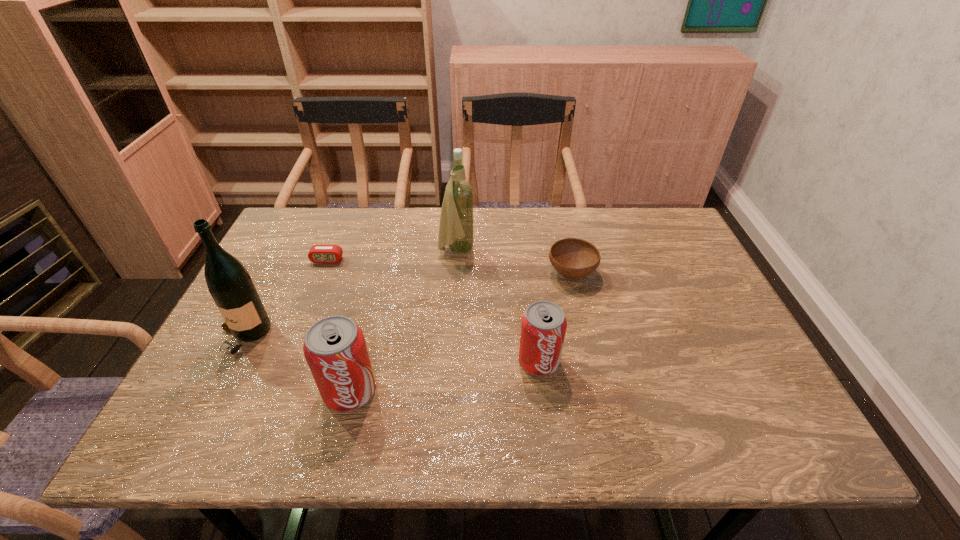
You are a GUI agent. You are given a task and a screenshot of the screen. Output one action in this format:
    pyautogui.click(x=<x>, y=<y>)
    Task: Click on the second shortest object
    
    Given the screenshot: What is the action you would take?
    (572, 257)

At what (x,y) coordinates should I click in order to perform the action: click on bowl. Please return your answer as a coordinate pair (x, y). Image resolution: width=960 pixels, height=540 pixels. Looking at the image, I should click on tap(572, 257).

Find the location of a particular element. This screenshot has width=960, height=540. free space located on the left of the fourth shortest object is located at coordinates (253, 391).

Locate an element on the screen. This screenshot has height=540, width=960. free space located 0.150m on the back of the shorter soda can is located at coordinates (532, 300).

I want to click on vacant space positioned on the front-facing side of the right wine bottle, so point(544,251).

Image resolution: width=960 pixels, height=540 pixels. I want to click on blank space located 0.290m on the front-facing side of the shortest object, so click(294, 343).

I want to click on free spot located on the right of the leftmost object, so point(414,336).

Where is `vacant area situated on the front of the second shortest object`? vacant area situated on the front of the second shortest object is located at coordinates (587, 336).

You are a GUI agent. You are given a task and a screenshot of the screen. Output one action in this format:
    pyautogui.click(x=<x>, y=<y>)
    Task: Click on the object that is at the far edge
    The width and height of the screenshot is (960, 540).
    Given the screenshot: What is the action you would take?
    pyautogui.click(x=456, y=229)

Where is `alarm clock that is at the left edge`? The height and width of the screenshot is (540, 960). alarm clock that is at the left edge is located at coordinates pos(318,253).